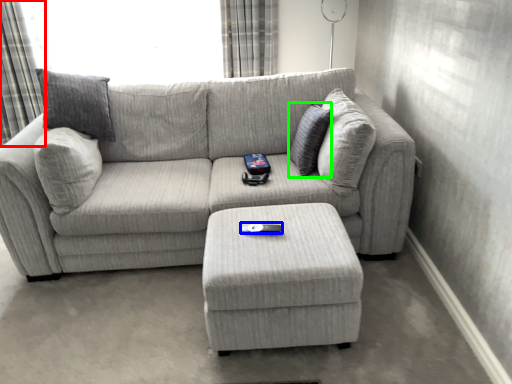
Question: Considering the real-world distances, which object is farthest from curtain (highlighted by a red box)? remote (highlighted by a blue box) or pillow (highlighted by a green box)?

Choices:
 (A) remote
 (B) pillow

Answer: (A)